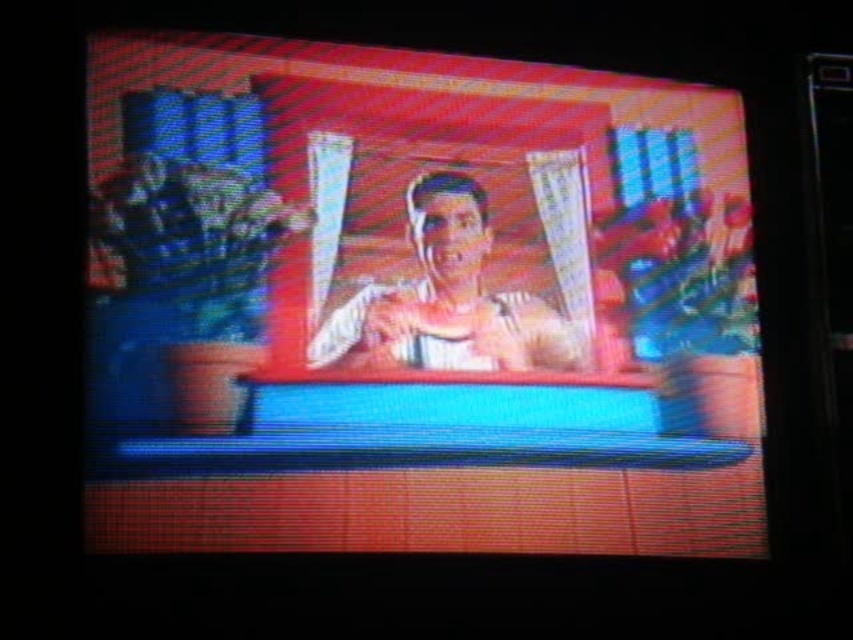
Question: Which object is farther from the camera taking this photo?

Choices:
 (A) matte plastic screen at center
 (B) smooth beige shirt at center

Answer: (B)

Question: Which point is farther from the camera taking this photo?

Choices:
 (A) (427, 204)
 (B) (331, 64)

Answer: (B)

Question: Is matte plastic screen at center to the right of smooth beige shirt at center from the viewer's perspective?

Choices:
 (A) yes
 (B) no

Answer: (A)

Question: Which of the following is the farthest from the observer?

Choices:
 (A) (643, 205)
 (B) (418, 252)

Answer: (A)

Question: Is matte plastic screen at center further to camera compared to smooth beige shirt at center?

Choices:
 (A) yes
 (B) no

Answer: (B)

Question: Is matte plastic screen at center further to camera compared to smooth beige shirt at center?

Choices:
 (A) yes
 (B) no

Answer: (B)